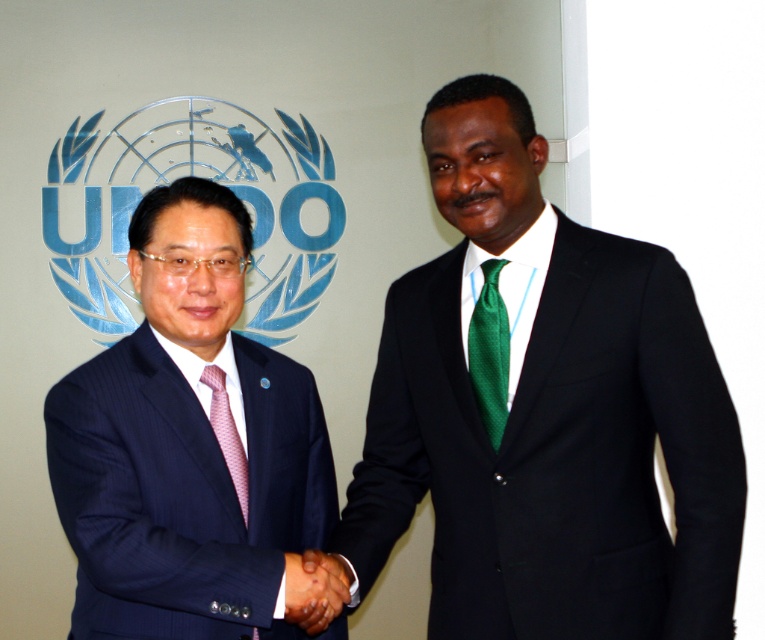
You are standing in front of the UNIDO backdrop and want to take a photo of the person wearing the matte black suit at left. Where should you position yourself to capture the person in the frame?

Position yourself so that the camera is aimed at the coordinates point (187,444) to capture the matte black suit at left in the frame.

You are standing in front of the image and want to locate the point at coordinates (549, 419). Based on the scene description, where exactly is this point located?

The point at coordinates (549, 419) is located on the shiny black suit at center.